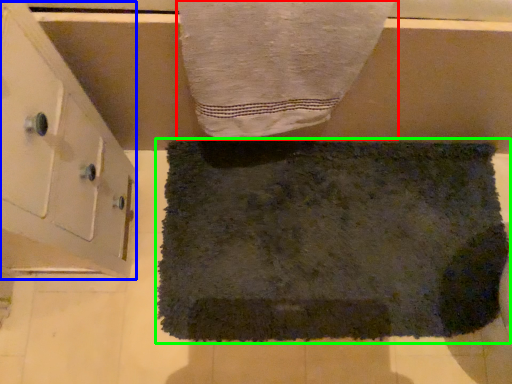
Question: Which object is the closest to the towel (highlighted by a red box)? Choose among these: cabinetry (highlighted by a blue box) or towel (highlighted by a green box).

Choices:
 (A) cabinetry
 (B) towel

Answer: (A)